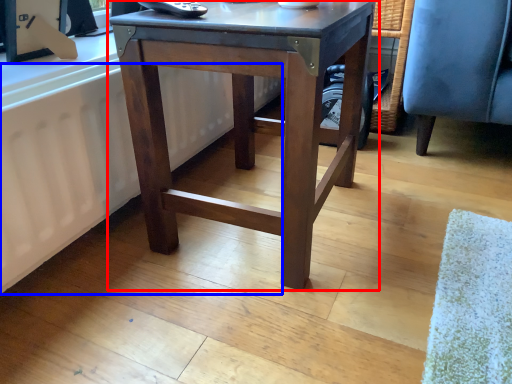
Question: Which object appears closest to the camera in this image, table (highlighted by a red box) or radiator (highlighted by a blue box)?

Choices:
 (A) table
 (B) radiator

Answer: (A)